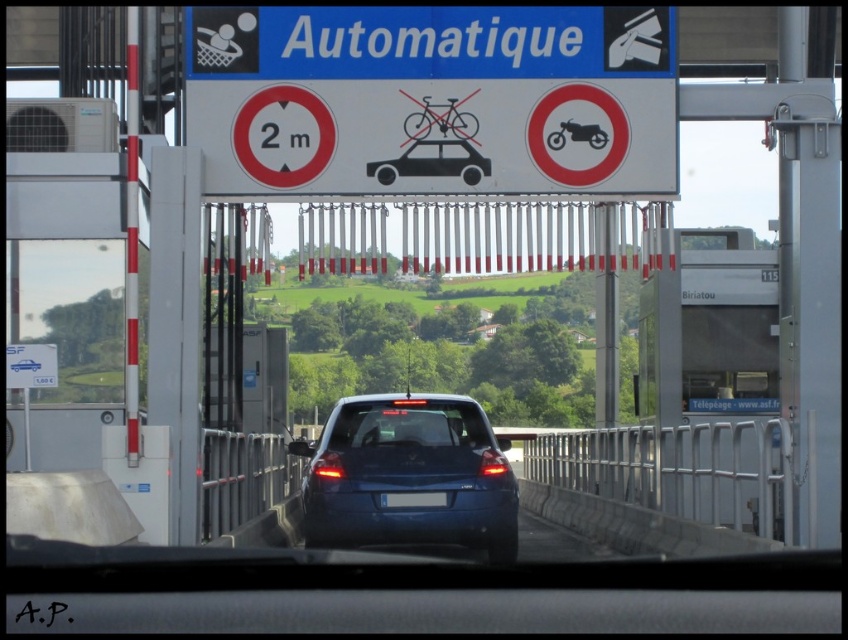
Does blue matte car at center appear under gray metallic barrier at center?

No.

Which is behind, point (500, 449) or point (734, 484)?

Point (500, 449)

Where is `blue matte car at center`? blue matte car at center is located at coordinates (408, 476).

Is blue matte car at center wider than blue plastic license plate at center?

Yes, blue matte car at center is wider than blue plastic license plate at center.

Can you confirm if blue matte car at center is positioned below blue plastic license plate at center?

No.

Where is `blue matte car at center`? blue matte car at center is located at coordinates (408, 476).

The height and width of the screenshot is (640, 848). Find the location of `gray metallic barrier at center`. gray metallic barrier at center is located at coordinates (679, 470).

Is gray metallic barrier at center to the left of blue plastic license plate at center from the viewer's perspective?

No, gray metallic barrier at center is not to the left of blue plastic license plate at center.

Who is more distant from viewer, (785,428) or (414,496)?

Positioned behind is point (414,496).

The width and height of the screenshot is (848, 640). In order to click on gray metallic barrier at center in this screenshot , I will do `click(679, 470)`.